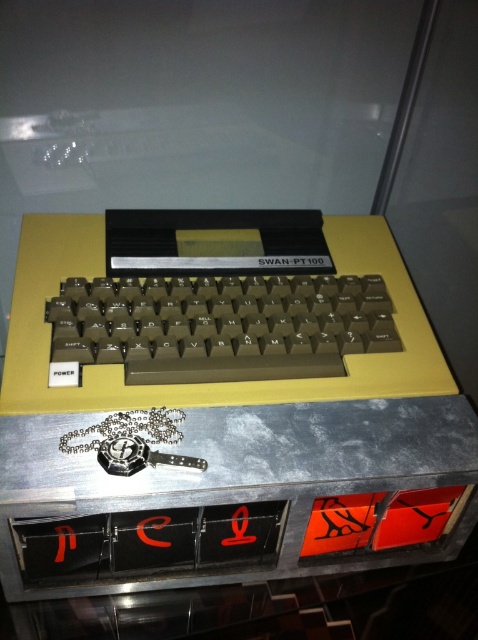
Does metallic silver table at center come in front of matte plastic keyboard at center?

Yes, it is in front of matte plastic keyboard at center.

Which is above, metallic silver table at center or matte plastic keyboard at center?

Positioned higher is matte plastic keyboard at center.

You are a GUI agent. You are given a task and a screenshot of the screen. Output one action in this format:
    pyautogui.click(x=<x>, y=<y>)
    Task: Click on the metallic silver table at center
    
    Given the screenshot: What is the action you would take?
    pyautogui.click(x=219, y=410)